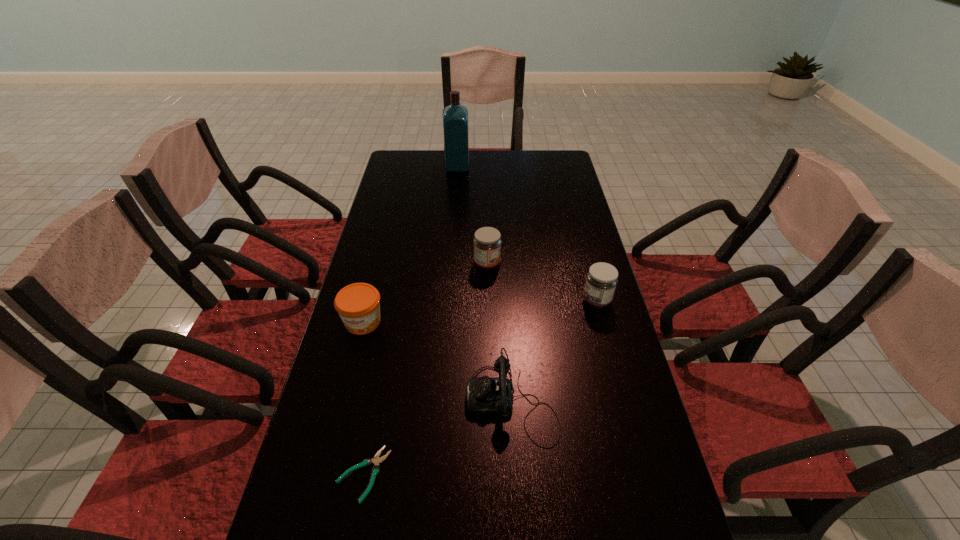
Where is `free point between the tallest object and the shortest jam`? The image size is (960, 540). free point between the tallest object and the shortest jam is located at coordinates (410, 244).

I want to click on free space between the shortest object and the leftmost jam, so click(363, 398).

At what (x,y) coordinates should I click in order to perform the action: click on blank region between the shortest object and the second jam from right to left. Please return your answer as a coordinate pair (x, y). Looking at the image, I should click on (425, 369).

What are the coordinates of `unoccupied area between the rightmost jam and the telephone` in the screenshot? It's located at (554, 352).

The image size is (960, 540). Find the location of `object that is the nearest to the telephone`. object that is the nearest to the telephone is located at coordinates (376, 460).

Choose which object is the nearest neighbor to the rightmost object. Please provide its 2D coordinates. Your answer should be formatted as a tuple, i.e. [(x, y)], where the tuple contains the x and y coordinates of a point satisfying the conditions above.

[(485, 396)]

Find the location of a particular element. The height and width of the screenshot is (540, 960). jam object that ranks as the closest to the third object from left to right is located at coordinates (487, 243).

Select which jam is the closest to the rightmost object. Please provide its 2D coordinates. Your answer should be formatted as a tuple, i.e. [(x, y)], where the tuple contains the x and y coordinates of a point satisfying the conditions above.

[(487, 243)]

I want to click on blank space that satisfies the following two spatial constraints: 1. on the flat label side of the liquor; 2. on the front label of the shortest jam, so click(446, 322).

Where is `blank space that satisfies the following two spatial constraints: 1. on the flat label side of the liquor; 2. on the front label of the leftmost jam`? blank space that satisfies the following two spatial constraints: 1. on the flat label side of the liquor; 2. on the front label of the leftmost jam is located at coordinates (446, 322).